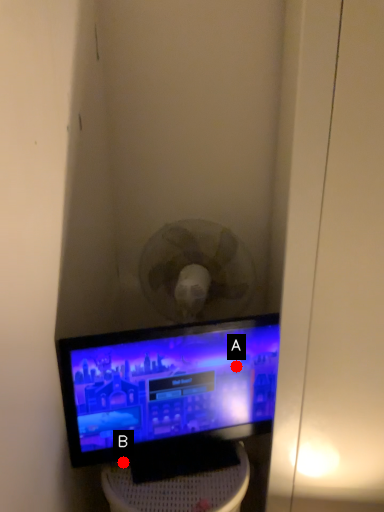
Question: Two points are circled on the image, labeled by A and B beside each circle. Among these points, which one is nearest to the camera?

Choices:
 (A) A is closer
 (B) B is closer

Answer: (B)